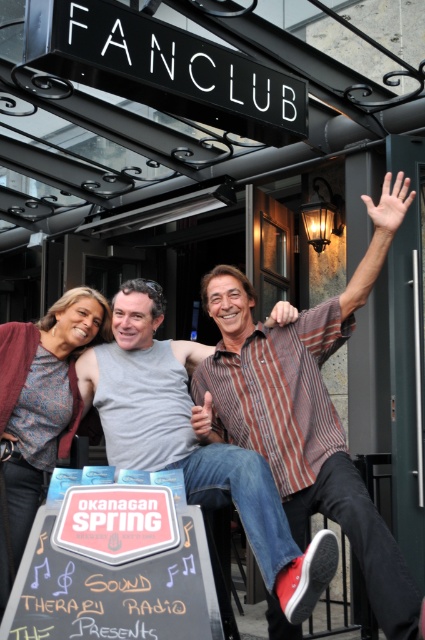
Which is above, striped cotton shirt at center or matte gray sweater at center?

Positioned higher is matte gray sweater at center.

Does striped cotton shirt at center appear on the right side of matte gray sweater at center?

Correct, you'll find striped cotton shirt at center to the right of matte gray sweater at center.

Which is behind, point (132, 326) or point (42, 323)?

The point (42, 323) is behind.

At what (x,y) coordinates should I click in order to perform the action: click on striped cotton shirt at center. Please return your answer as a coordinate pair (x, y). Image resolution: width=425 pixels, height=640 pixels. Looking at the image, I should click on (192, 442).

Who is lower down, striped cotton shirt at upper right or striped cotton shirt at center?

striped cotton shirt at center is lower down.

From the picture: Is striped cotton shirt at upper right closer to the viewer compared to striped cotton shirt at center?

Yes, striped cotton shirt at upper right is closer to the viewer.

Which is behind, point (377, 518) or point (130, 394)?

The point (130, 394) is more distant.

The height and width of the screenshot is (640, 425). I want to click on striped cotton shirt at upper right, so click(306, 412).

Is point (237, 362) positioned after point (27, 333)?

No, (237, 362) is closer to viewer.

Image resolution: width=425 pixels, height=640 pixels. What do you see at coordinates (306, 412) in the screenshot?
I see `striped cotton shirt at upper right` at bounding box center [306, 412].

Where is `striped cotton shirt at upper right`? Image resolution: width=425 pixels, height=640 pixels. striped cotton shirt at upper right is located at coordinates (306, 412).

This screenshot has width=425, height=640. I want to click on striped cotton shirt at upper right, so click(x=306, y=412).